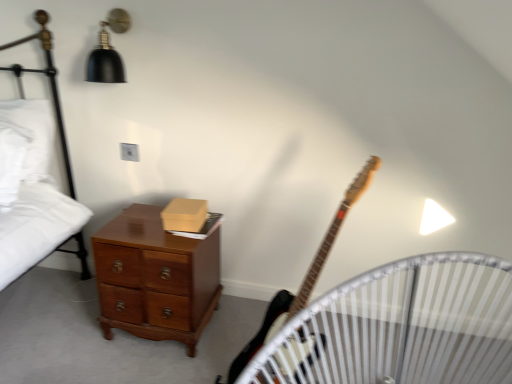
Question: Is wooden crib at lower left facing towards white soft pillow at left?

Choices:
 (A) no
 (B) yes

Answer: (A)

Question: Can you confirm if wooden crib at lower left is bigger than white soft pillow at left?

Choices:
 (A) no
 (B) yes

Answer: (B)

Question: From a real-world perspective, is wooden crib at lower left on top of white soft pillow at left?

Choices:
 (A) no
 (B) yes

Answer: (A)

Question: From the image's perspective, is wooden crib at lower left beneath white soft pillow at left?

Choices:
 (A) no
 (B) yes

Answer: (B)

Question: Is the depth of wooden crib at lower left less than that of white soft pillow at left?

Choices:
 (A) no
 (B) yes

Answer: (B)

Question: Is point (104, 39) closer or farther from the camera than point (48, 66)?

Choices:
 (A) closer
 (B) farther

Answer: (A)

Question: Considering the positions of black matte lampshade at upper left and white cotton bed at left in the image, is black matte lampshade at upper left bigger or smaller than white cotton bed at left?

Choices:
 (A) small
 (B) big

Answer: (A)

Question: From a real-world perspective, is black matte lampshade at upper left physically located above or below white cotton bed at left?

Choices:
 (A) below
 (B) above

Answer: (B)

Question: Is black matte lampshade at upper left wider or thinner than white cotton bed at left?

Choices:
 (A) wide
 (B) thin

Answer: (B)

Question: In terms of height, does white cotton bed at left look taller or shorter compared to wooden crib at lower left?

Choices:
 (A) short
 (B) tall

Answer: (B)

Question: From the image's perspective, is white cotton bed at left above or below wooden crib at lower left?

Choices:
 (A) below
 (B) above

Answer: (B)

Question: Is white cotton bed at left situated inside wooden crib at lower left or outside?

Choices:
 (A) outside
 (B) inside

Answer: (A)

Question: In the image, is white cotton bed at left positioned in front of or behind wooden crib at lower left?

Choices:
 (A) front
 (B) behind

Answer: (B)

Question: Considering the positions of point (193, 225) and point (261, 337), is point (193, 225) closer or farther from the camera than point (261, 337)?

Choices:
 (A) farther
 (B) closer

Answer: (A)

Question: From the image's perspective, is matte brown box at center positioned above or below wooden electric guitar at center-right?

Choices:
 (A) above
 (B) below

Answer: (A)